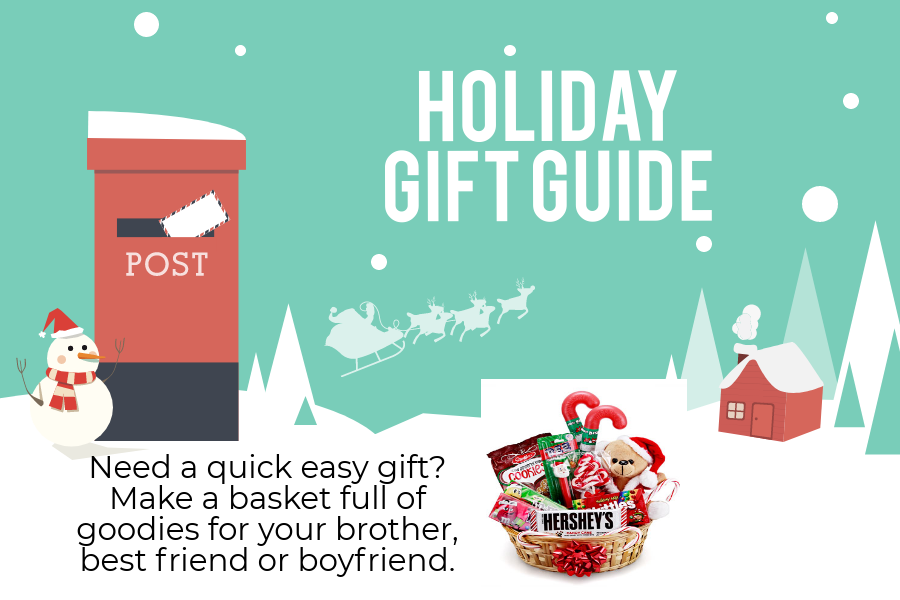
Identify the location of teddy bear. The height and width of the screenshot is (600, 900). (634, 467).